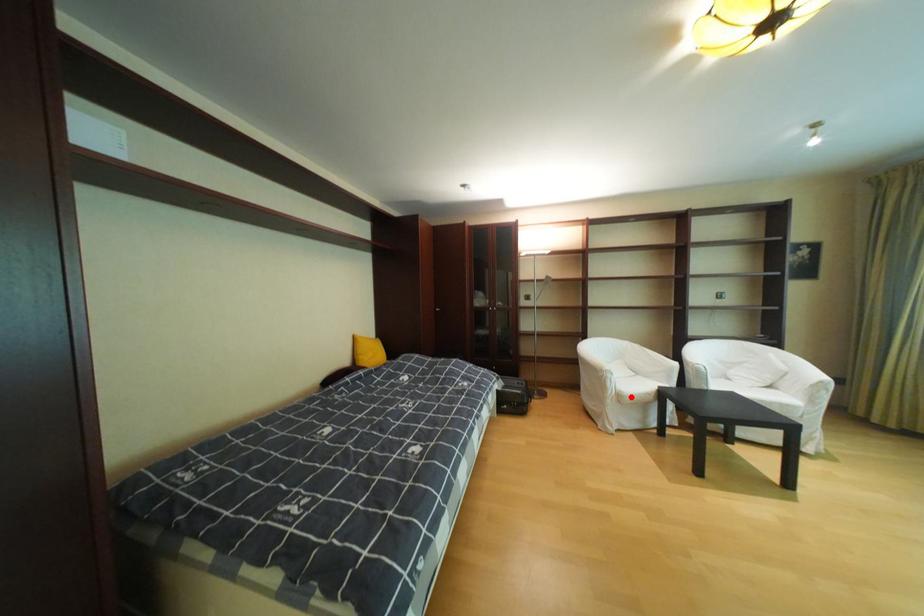
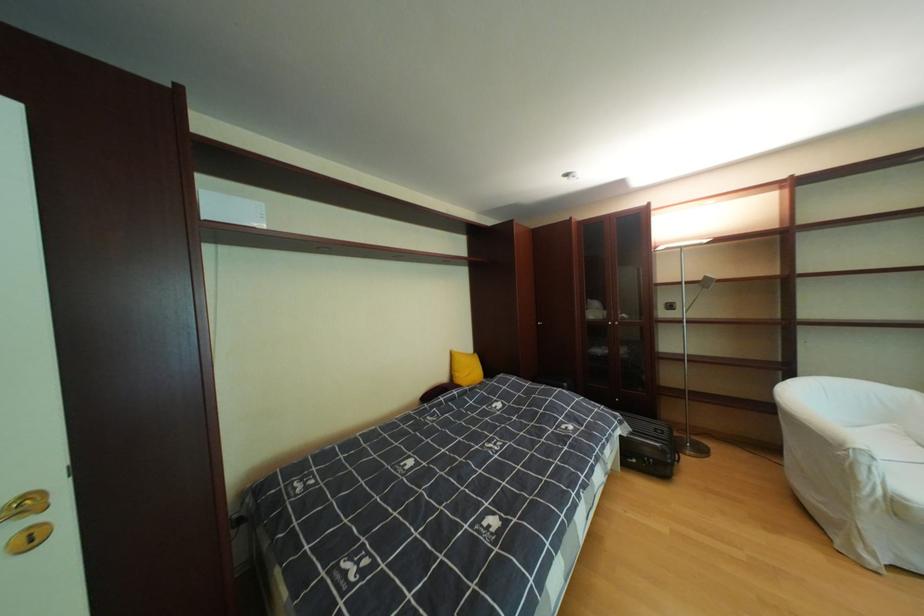
Question: I am providing you with two images of the same scene from different viewpoints. Given a red point in image1, look at the same physical point in image2. Is it:

Choices:
 (A) Closer to the viewpoint
 (B) Farther from the viewpoint

Answer: (A)